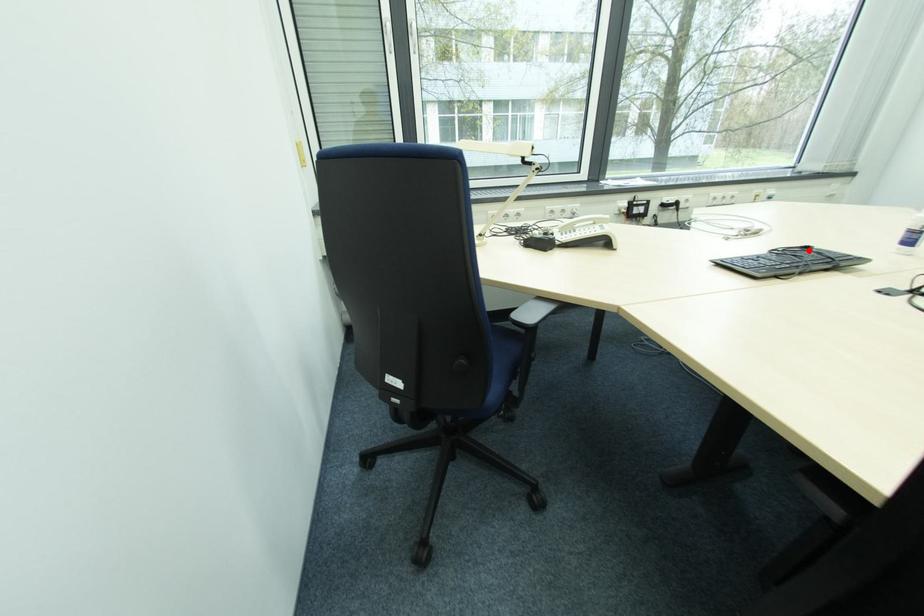
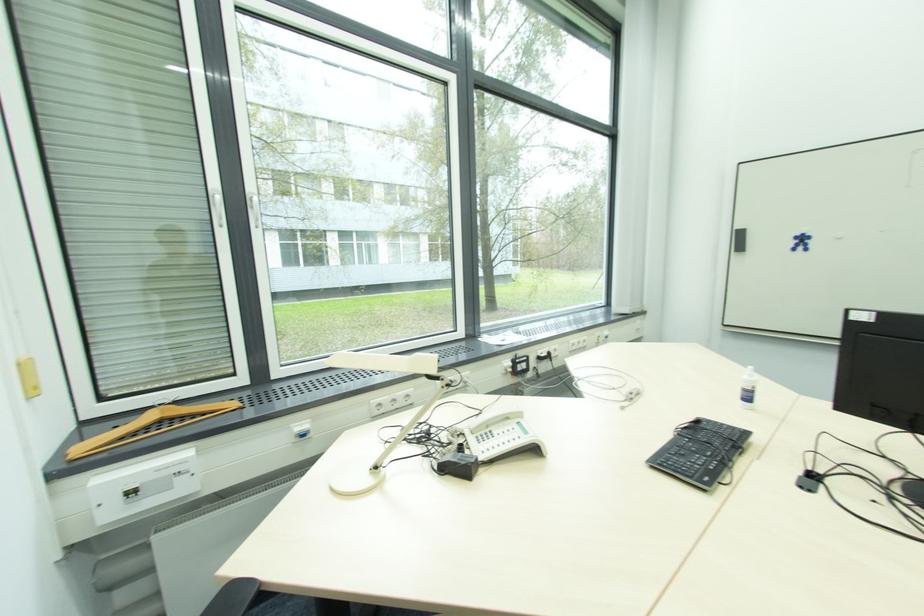
Find the pixel in the second image that matches the highlighted location in the first image.

(700, 424)